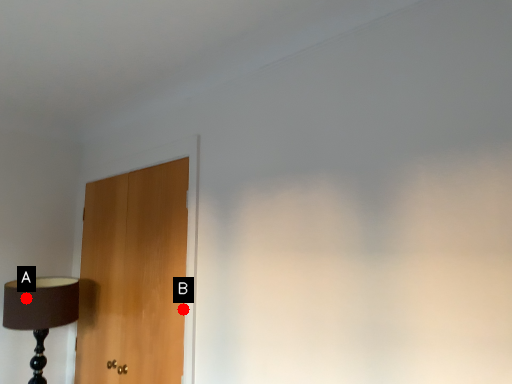
Question: Two points are circled on the image, labeled by A and B beside each circle. Which point is closer to the camera taking this photo?

Choices:
 (A) A is closer
 (B) B is closer

Answer: (B)